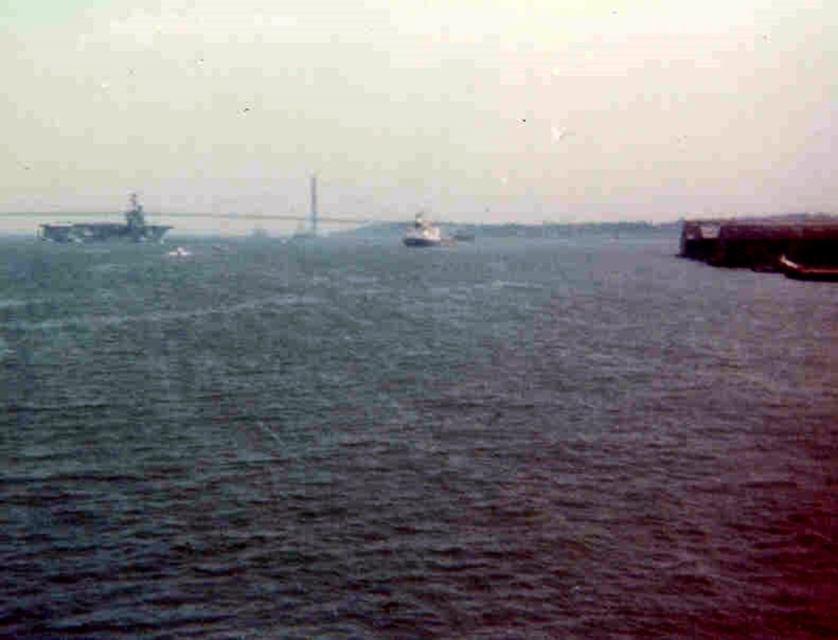
Question: Can you confirm if dark blue water at center is positioned to the right of metallic gray ship at left?

Choices:
 (A) no
 (B) yes

Answer: (B)

Question: Which point appears farthest from the camera in this image?

Choices:
 (A) (824, 497)
 (B) (428, 228)
 (C) (86, 237)

Answer: (C)

Question: Does dark blue water at center have a smaller size compared to white glossy boat at center?

Choices:
 (A) no
 (B) yes

Answer: (A)

Question: Among these objects, which one is farthest from the camera?

Choices:
 (A) white glossy boat at center
 (B) metallic gray ship at left

Answer: (B)

Question: Can you confirm if metallic gray ship at left is positioned below white glossy boat at center?

Choices:
 (A) no
 (B) yes

Answer: (A)

Question: Which object appears closest to the camera in this image?

Choices:
 (A) dark blue water at center
 (B) white glossy boat at center
 (C) metallic gray ship at left

Answer: (A)